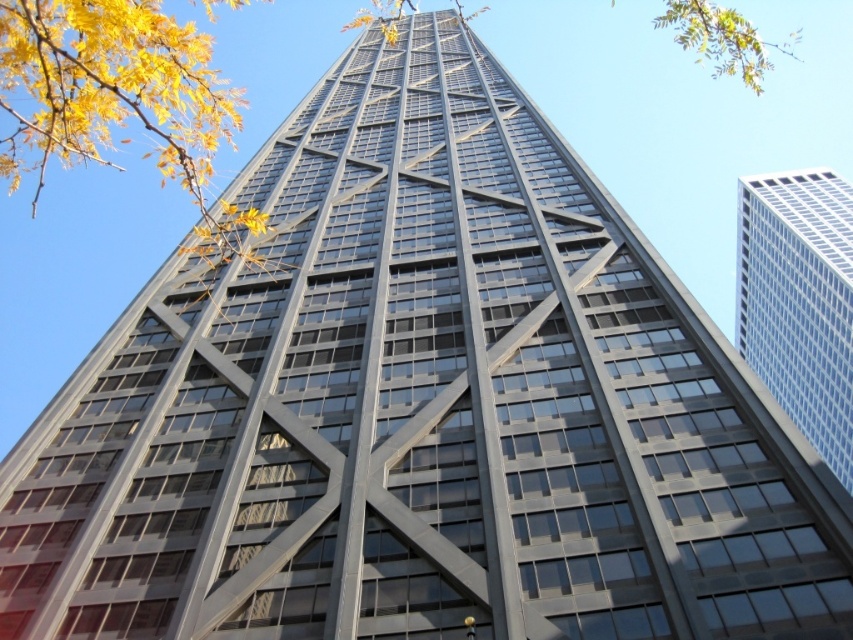
Is yellow leaves at upper left above white glass building at right?

Yes, yellow leaves at upper left is above white glass building at right.

Is yellow leaves at upper left positioned behind white glass building at right?

That is False.

Which is behind, point (206, 68) or point (786, 209)?

Point (786, 209)

I want to click on yellow leaves at upper left, so click(x=119, y=99).